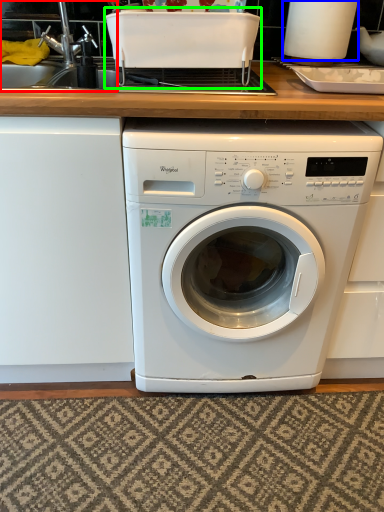
Question: Which is nearer to the sink (highlighted by a red box)? appliance (highlighted by a blue box) or appliance (highlighted by a green box).

Choices:
 (A) appliance
 (B) appliance

Answer: (B)